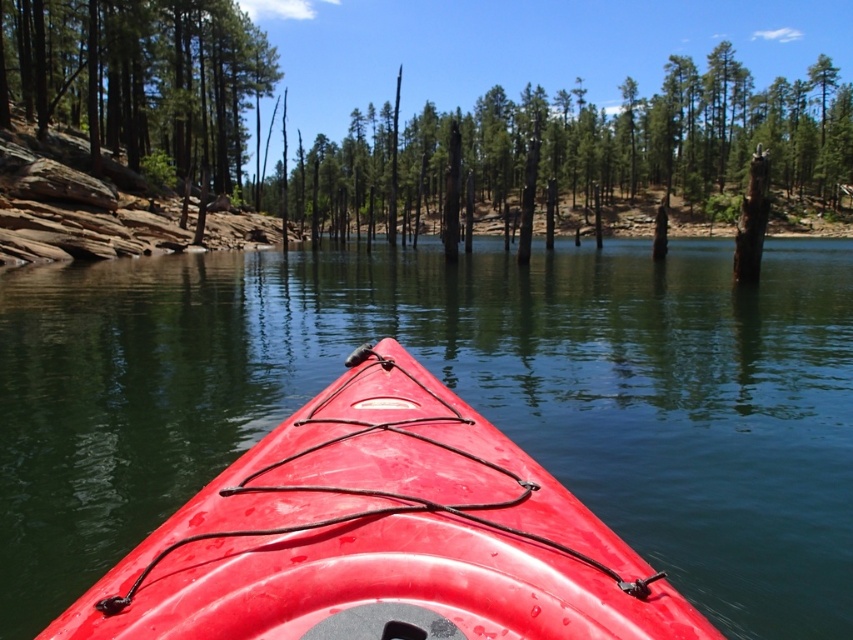
Question: Where is glossy plastic kayak at center located in relation to dead wood stump at center in the image?

Choices:
 (A) left
 (B) right

Answer: (A)

Question: Does dead wood stump at center appear over smooth brown log at left?

Choices:
 (A) yes
 (B) no

Answer: (A)

Question: Which of the following is the closest to the observer?

Choices:
 (A) 242,538
 (B) 773,104
 (C) 112,17

Answer: (A)

Question: Which object is closer to the camera taking this photo?

Choices:
 (A) dead wood stump at center
 (B) glossy plastic kayak at center
 (C) smooth brown log at left

Answer: (B)

Question: Which is farther from the dead wood stump at center?

Choices:
 (A) glossy plastic kayak at center
 (B) smooth brown log at left

Answer: (A)

Question: Is glossy plastic kayak at center further to the viewer compared to smooth brown log at left?

Choices:
 (A) yes
 (B) no

Answer: (B)